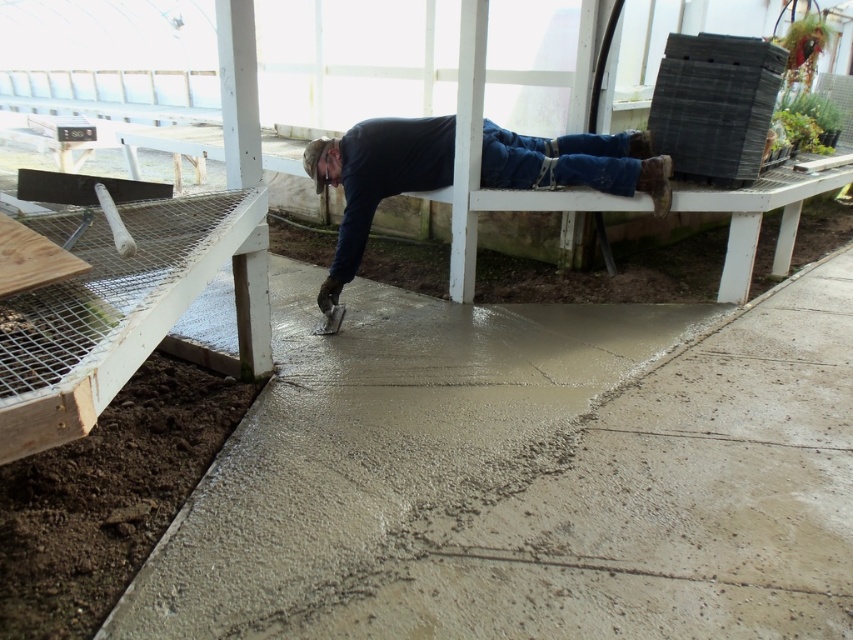
You are a construction worker who needs to move a heavy tool from the brown soil at lower left to the smooth concrete at center. Which direction should you move the tool to place it on the correct surface?

The smooth concrete at center is to the right of brown soil at lower left, so you should move the tool to the right to place it on the smooth concrete at center.

You are a contractor assessing the workspace. You notice the smooth concrete at center and the blue denim jeans at upper center. Which one requires more space to accommodate in this area?

The smooth concrete at center requires more space because it is larger in size than the blue denim jeans at upper center.